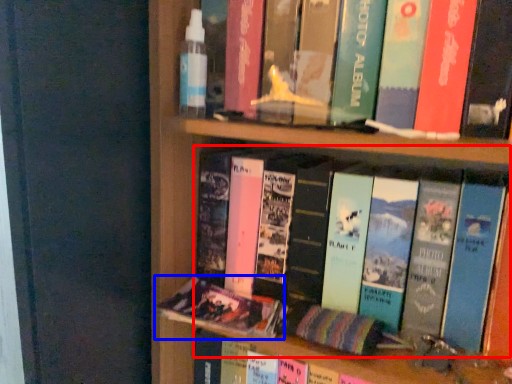
Question: Which object is closer to the camera taking this photo, book (highlighted by a red box) or book (highlighted by a blue box)?

Choices:
 (A) book
 (B) book

Answer: (A)